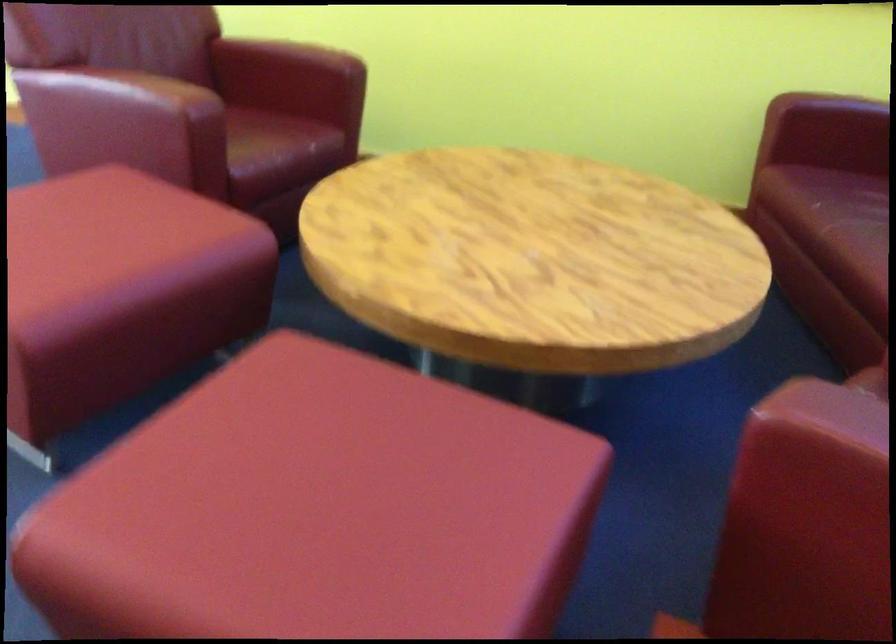
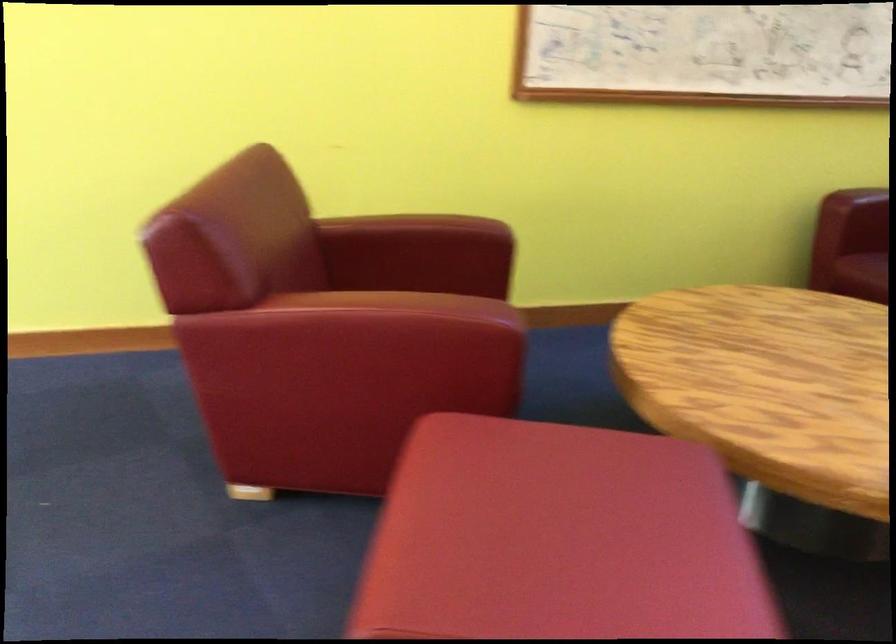
Find the pixel in the second image that matches pixel 278 77 in the first image.

(418, 254)